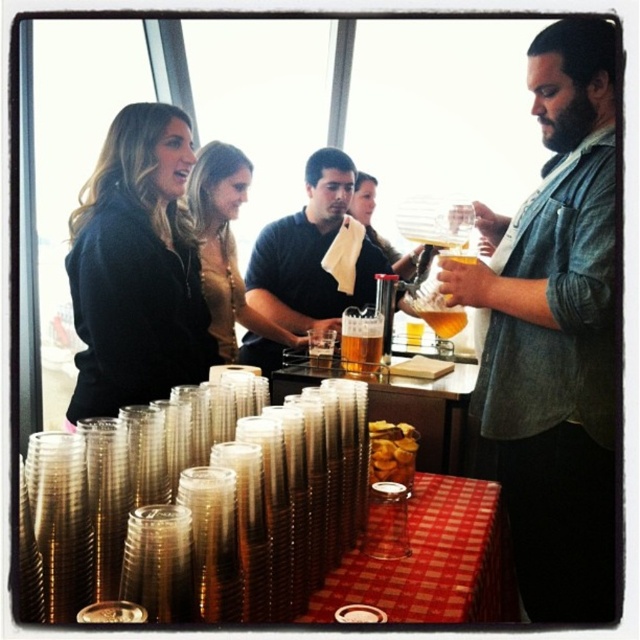
Question: Does black sweater at upper left have a smaller size compared to matte black shirt at center?

Choices:
 (A) yes
 (B) no

Answer: (A)

Question: Which object appears farthest from the camera in this image?

Choices:
 (A) matte gold necklace at upper center
 (B) denim shirt at right
 (C) red checkered tablecloth at lower center
 (D) black sweater at upper left

Answer: (A)

Question: Which of the following is the farthest from the observer?

Choices:
 (A) (460, 321)
 (B) (369, 371)
 (C) (284, 333)

Answer: (C)

Question: Does denim shirt at right appear under matte black shirt at center?

Choices:
 (A) yes
 (B) no

Answer: (A)

Question: Is denim shirt at right behind red checkered tablecloth at lower center?

Choices:
 (A) no
 (B) yes

Answer: (B)

Question: Among these objects, which one is farthest from the camera?

Choices:
 (A) black sweater at upper left
 (B) translucent glass carafe at center
 (C) matte gold necklace at upper center
 (D) matte black shirt at center

Answer: (D)